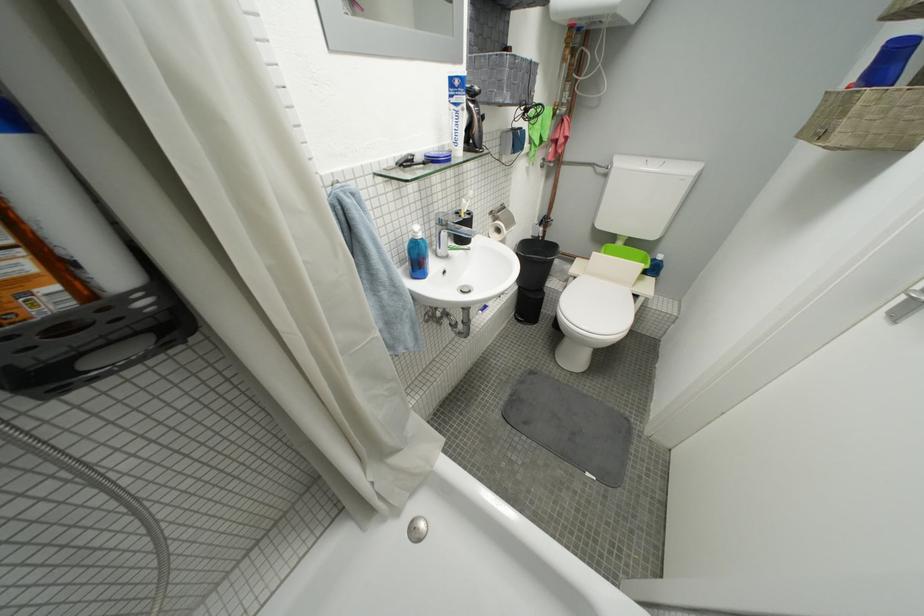
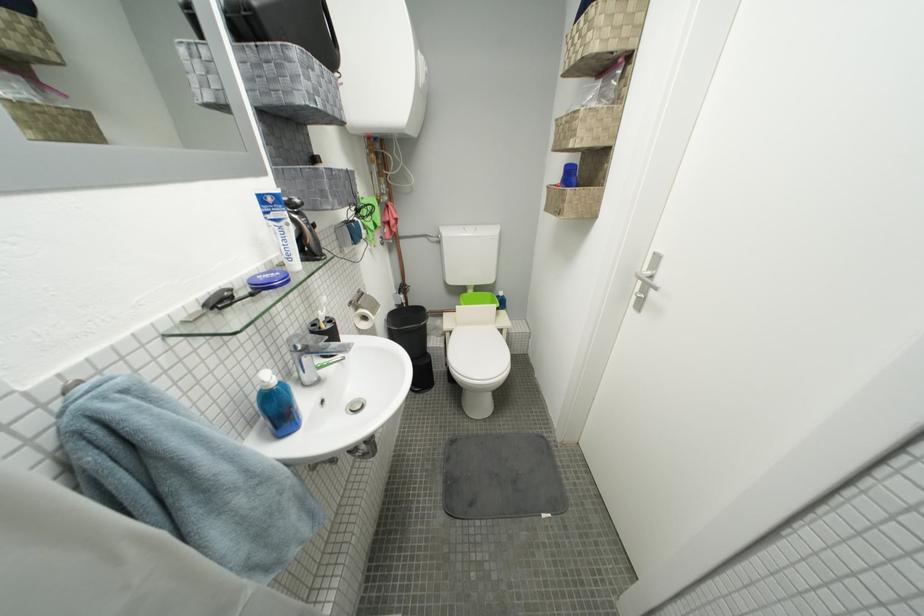
Question: The images are taken continuously from a first-person perspective. In which direction is your viewpoint rotating?

Choices:
 (A) Left
 (B) Right
 (C) Up
 (D) Down

Answer: (B)